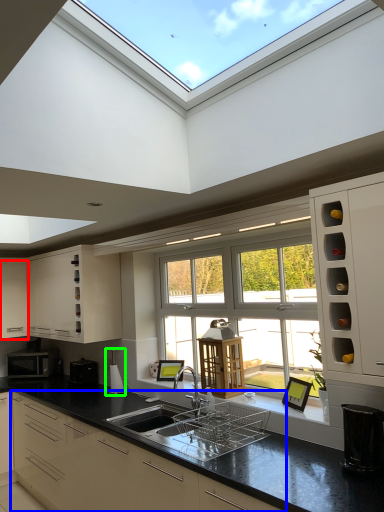
Question: Which is nearer to the cabinetry (highlighted by a red box)? cabinetry (highlighted by a blue box) or appliance (highlighted by a green box).

Choices:
 (A) cabinetry
 (B) appliance

Answer: (B)